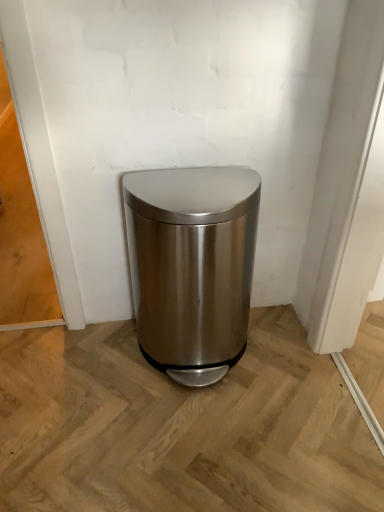
Question: Should I look upward or downward to see satin metallic trash can at center?

Choices:
 (A) down
 (B) up

Answer: (A)